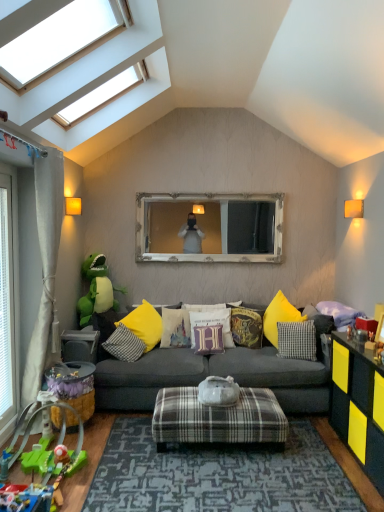
Find the location of `vacant space underneath wooden framed mirror at center (from a real-world perspective)`. vacant space underneath wooden framed mirror at center (from a real-world perspective) is located at coordinates (221, 301).